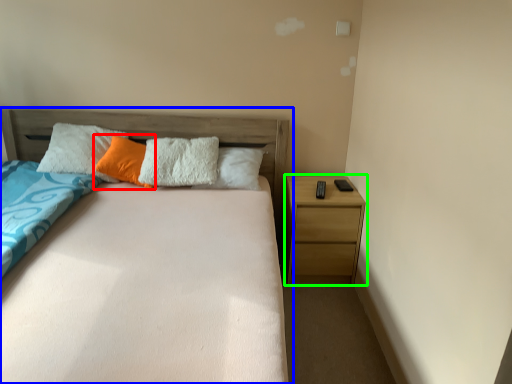
Question: Which object is the farthest from pillow (highlighted by a red box)? Choose among these: bed (highlighted by a blue box) or nightstand (highlighted by a green box).

Choices:
 (A) bed
 (B) nightstand

Answer: (B)